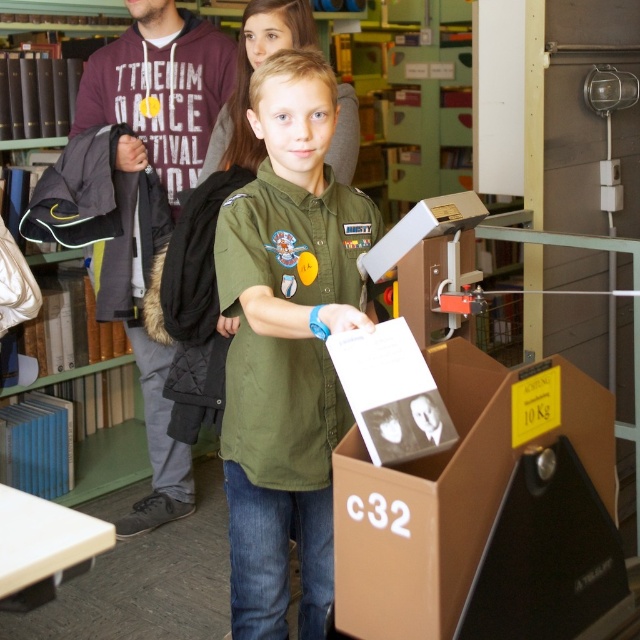
Question: Is green uniform shirt at center positioned at the back of brown cardboard box at center?

Choices:
 (A) yes
 (B) no

Answer: (B)

Question: Which of these objects is positioned closest to the brown cardboard box at center?

Choices:
 (A) green uniform shirt at center
 (B) dark gray hoodie at upper left

Answer: (B)

Question: Considering the relative positions of green uniform shirt at center and dark gray hoodie at upper left in the image provided, where is green uniform shirt at center located with respect to dark gray hoodie at upper left?

Choices:
 (A) right
 (B) left

Answer: (A)

Question: Which point is farther from the camera taking this photo?

Choices:
 (A) (189, 22)
 (B) (104, 376)

Answer: (B)

Question: Among these points, which one is nearest to the camera?

Choices:
 (A) (172, 188)
 (B) (252, 90)

Answer: (B)

Question: Where is green uniform shirt at center located in relation to brown cardboard box at center in the image?

Choices:
 (A) above
 (B) below

Answer: (A)